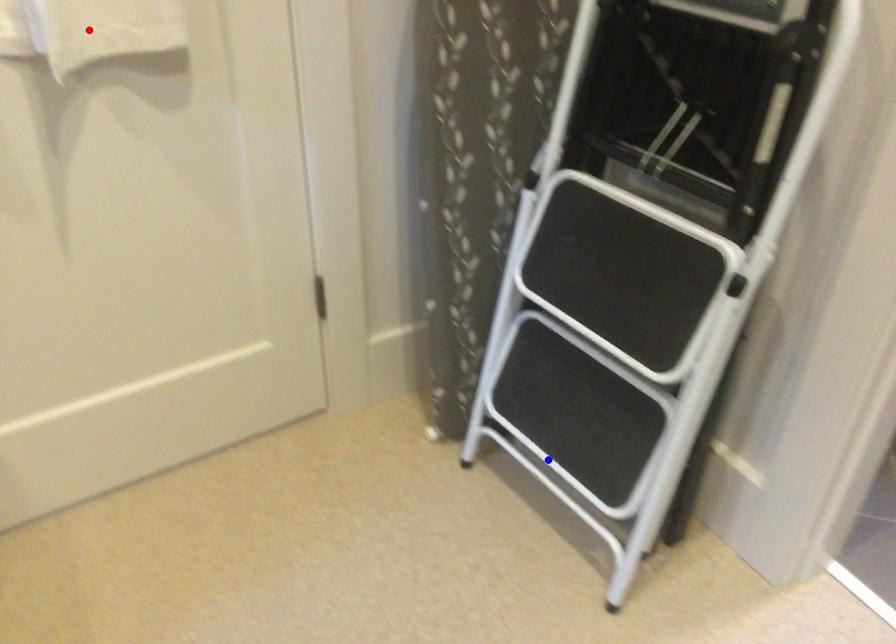
Question: In the image, two points are highlighted. Which point is nearer to the camera? Reply with the corresponding letter.

Choices:
 (A) blue point
 (B) red point

Answer: (B)